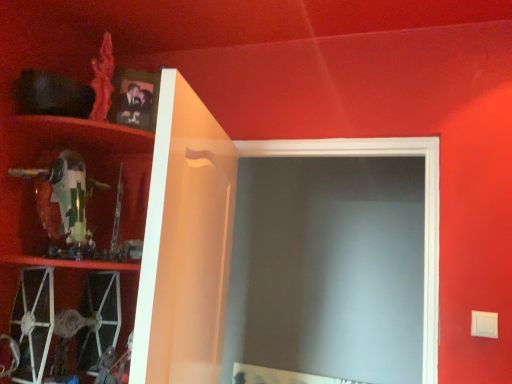
Question: Considering the relative sizes of metallic silver tie fighter at lower left, the 1th cabinet from the left, and green plastic toy at left, placed as the second cabinet when sorted from left to right, in the image provided, is metallic silver tie fighter at lower left, the 1th cabinet from the left, smaller than green plastic toy at left, placed as the second cabinet when sorted from left to right,?

Choices:
 (A) yes
 (B) no

Answer: (B)

Question: Is green plastic toy at left, the 2th cabinet from the right, located within metallic silver tie fighter at lower left, which is counted as the 3th cabinet, starting from the right?

Choices:
 (A) yes
 (B) no

Answer: (B)

Question: Is metallic silver tie fighter at lower left, the 1th cabinet from the left, at the right side of green plastic toy at left, placed as the second cabinet when sorted from left to right?

Choices:
 (A) yes
 (B) no

Answer: (B)

Question: Can you confirm if metallic silver tie fighter at lower left, which is counted as the 3th cabinet, starting from the right, is shorter than green plastic toy at left, placed as the second cabinet when sorted from left to right?

Choices:
 (A) no
 (B) yes

Answer: (A)

Question: Is metallic silver tie fighter at lower left, which is counted as the 3th cabinet, starting from the right, positioned with its back to green plastic toy at left, the 2th cabinet from the right?

Choices:
 (A) no
 (B) yes

Answer: (A)

Question: Can you confirm if metallic silver tie fighter at lower left, which is counted as the 3th cabinet, starting from the right, is wider than green plastic toy at left, placed as the second cabinet when sorted from left to right?

Choices:
 (A) yes
 (B) no

Answer: (A)

Question: Can you confirm if metallic silver tie fighter at lower left, which is counted as the 3th cabinet, starting from the right, is shorter than white glossy cabinet at upper left, acting as the third cabinet starting from the left?

Choices:
 (A) yes
 (B) no

Answer: (A)

Question: Does metallic silver tie fighter at lower left, which is counted as the 3th cabinet, starting from the right, have a lesser width compared to white glossy cabinet at upper left, acting as the third cabinet starting from the left?

Choices:
 (A) no
 (B) yes

Answer: (A)

Question: Does metallic silver tie fighter at lower left, the 1th cabinet from the left, come behind white glossy cabinet at upper left, acting as the third cabinet starting from the left?

Choices:
 (A) yes
 (B) no

Answer: (A)

Question: From the image's perspective, is metallic silver tie fighter at lower left, the 1th cabinet from the left, above white glossy cabinet at upper left, acting as the third cabinet starting from the left?

Choices:
 (A) yes
 (B) no

Answer: (B)

Question: Would you say metallic silver tie fighter at lower left, which is counted as the 3th cabinet, starting from the right, is outside white glossy cabinet at upper left, acting as the third cabinet starting from the left?

Choices:
 (A) yes
 (B) no

Answer: (A)

Question: Is metallic silver tie fighter at lower left, which is counted as the 3th cabinet, starting from the right, facing towards white glossy cabinet at upper left, which is the 1th cabinet from right to left?

Choices:
 (A) yes
 (B) no

Answer: (B)

Question: Can you confirm if matte black photo frame at upper left is smaller than green plastic toy at left, the 2th cabinet from the right?

Choices:
 (A) no
 (B) yes

Answer: (B)